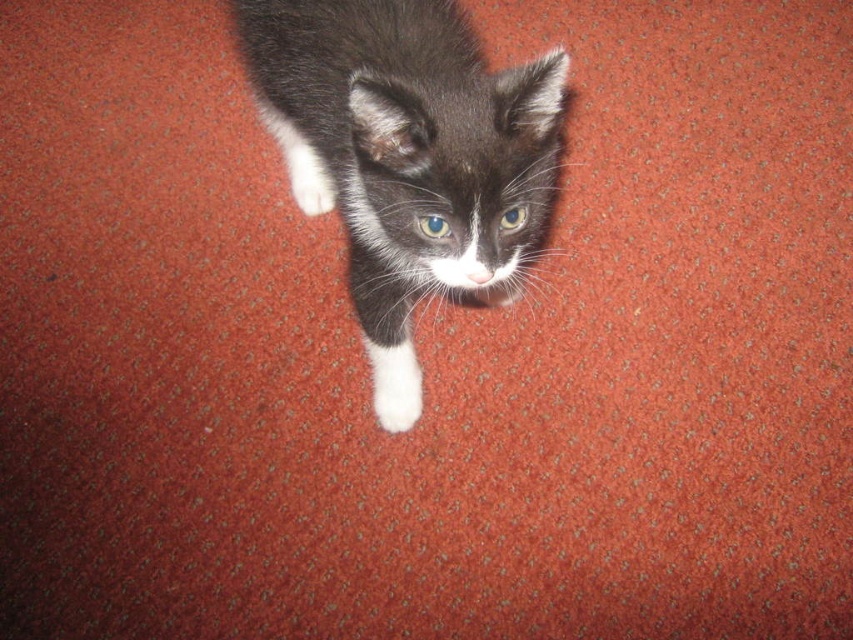
Question: Is black and white fur kitten at center positioned at the back of white fluffy paw at center?

Choices:
 (A) yes
 (B) no

Answer: (B)

Question: Is black and white fur kitten at center wider than white fluffy paw at center?

Choices:
 (A) yes
 (B) no

Answer: (A)

Question: Can you confirm if black and white fur kitten at center is positioned to the right of white fluffy paw at center?

Choices:
 (A) yes
 (B) no

Answer: (B)

Question: Among these objects, which one is nearest to the camera?

Choices:
 (A) white fluffy paw at center
 (B) black and white fur kitten at center

Answer: (B)